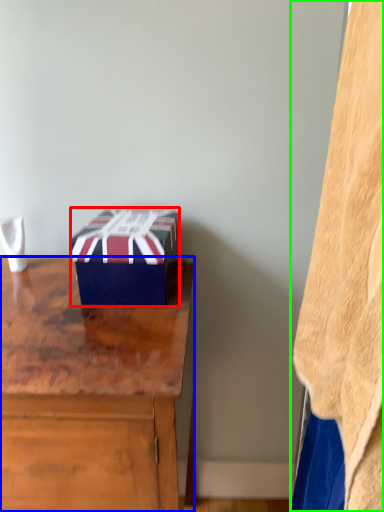
Question: Which object is positioned farthest from box (highlighted by a red box)? Select from desk (highlighted by a blue box) and blanket (highlighted by a green box).

Choices:
 (A) desk
 (B) blanket

Answer: (B)